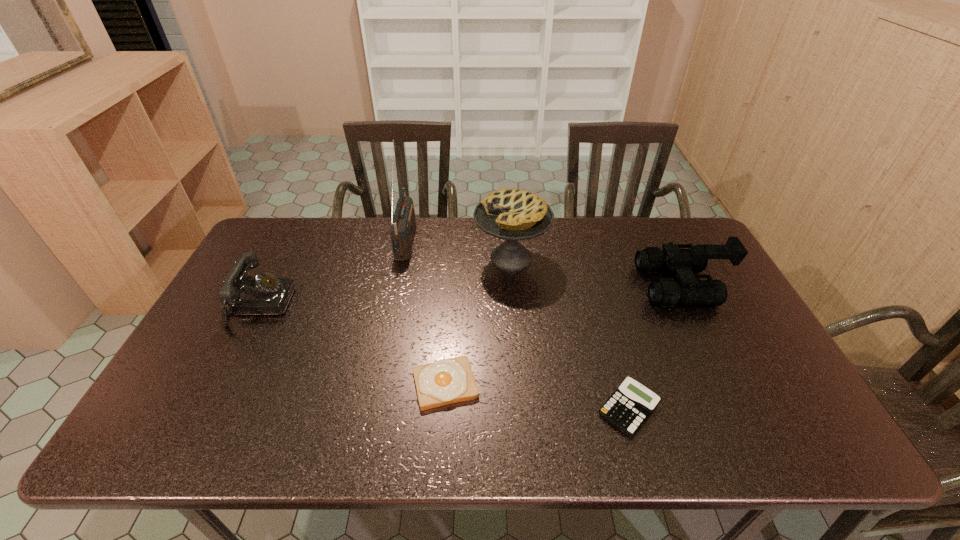
In order to click on vacant space located 0.380m on the cut side of the fifth shortest object in this screenshot , I will do tap(358, 258).

In order to click on vacant region located 0.140m on the cut side of the fifth shortest object in this screenshot , I will do `click(431, 258)`.

In order to click on vacant area situated 0.160m on the cut side of the fifth shortest object in this screenshot , I will do `click(425, 258)`.

The width and height of the screenshot is (960, 540). Identify the location of vacant area located 0.250m on the front lenses of the binoculars. (560, 285).

The width and height of the screenshot is (960, 540). In order to click on free location located 0.270m on the front lenses of the binoculars in this screenshot , I will do `click(553, 285)`.

Identify the location of vacant space positioned 0.220m on the front lenses of the binoculars. (569, 285).

Find the location of a particular element. This screenshot has height=540, width=960. free space located 0.310m on the dial of the leftmost object is located at coordinates (396, 305).

The height and width of the screenshot is (540, 960). In order to click on vacant region located 0.130m on the left of the toast in this screenshot , I will do `click(358, 384)`.

Identify the location of vacant space located on the left of the fifth object from left to right. The height and width of the screenshot is (540, 960). (528, 409).

What are the coordinates of `radio receiver situated at the far edge` in the screenshot? It's located at (403, 224).